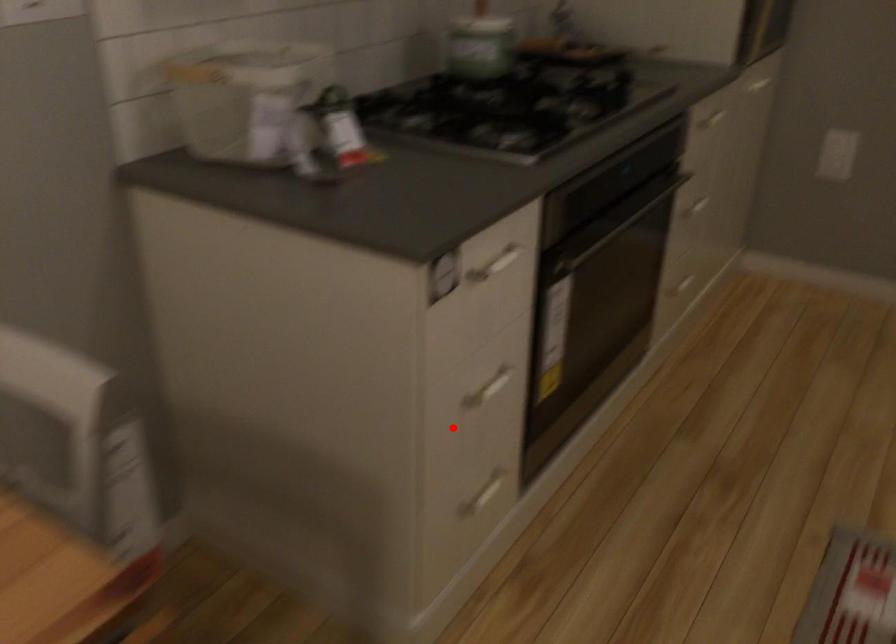
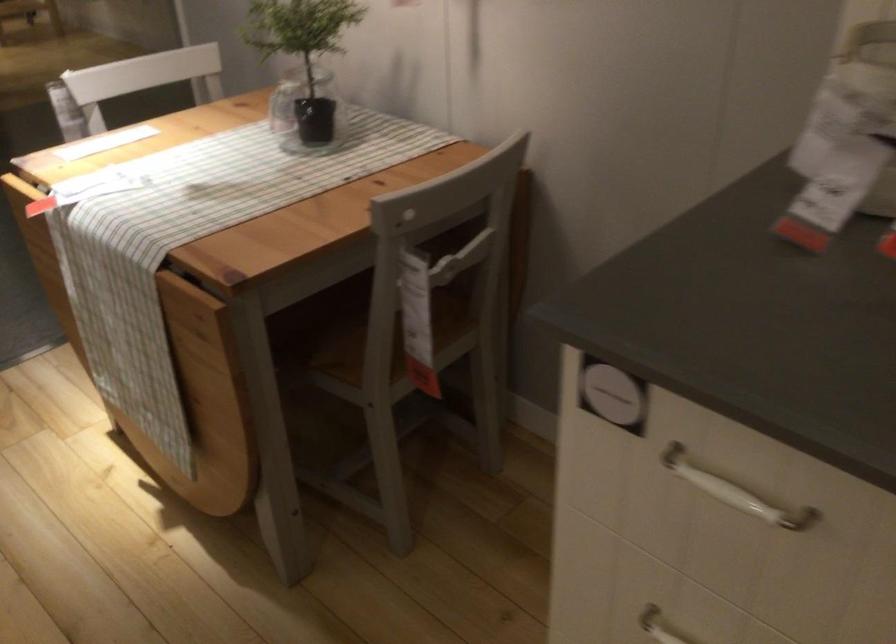
The point at the highlighted location is marked in the first image. Where is the corresponding point in the second image?

(659, 626)